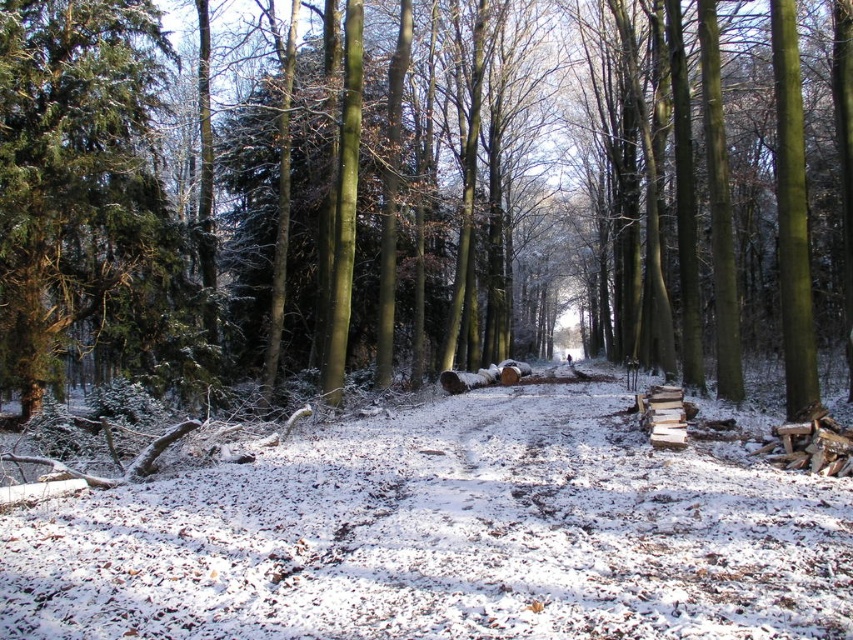
Question: Which is farther from the white snow-covered path at center?

Choices:
 (A) green matte tree at center
 (B) green textured evergreen tree at left

Answer: (A)

Question: Is green matte tree at center wider than white snow-covered path at center?

Choices:
 (A) no
 (B) yes

Answer: (B)

Question: Which object is positioned closest to the green matte tree at center?

Choices:
 (A) white snow-covered path at center
 (B) green textured evergreen tree at left

Answer: (B)

Question: Does green matte tree at center have a greater width compared to white snow-covered path at center?

Choices:
 (A) no
 (B) yes

Answer: (B)

Question: In this image, where is green matte tree at center located relative to white snow-covered path at center?

Choices:
 (A) right
 (B) left

Answer: (A)

Question: Which object appears farthest from the camera in this image?

Choices:
 (A) white snow-covered path at center
 (B) green textured evergreen tree at left

Answer: (B)